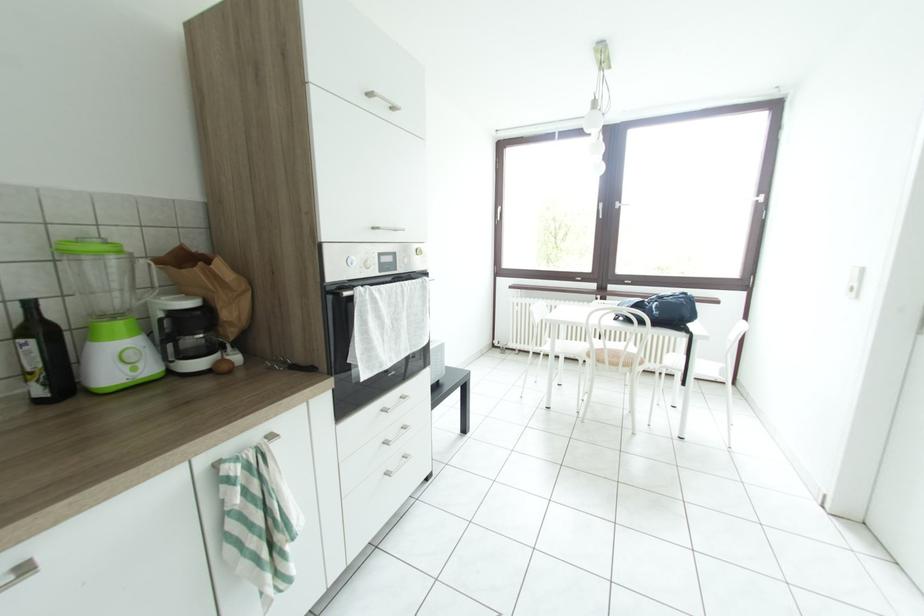
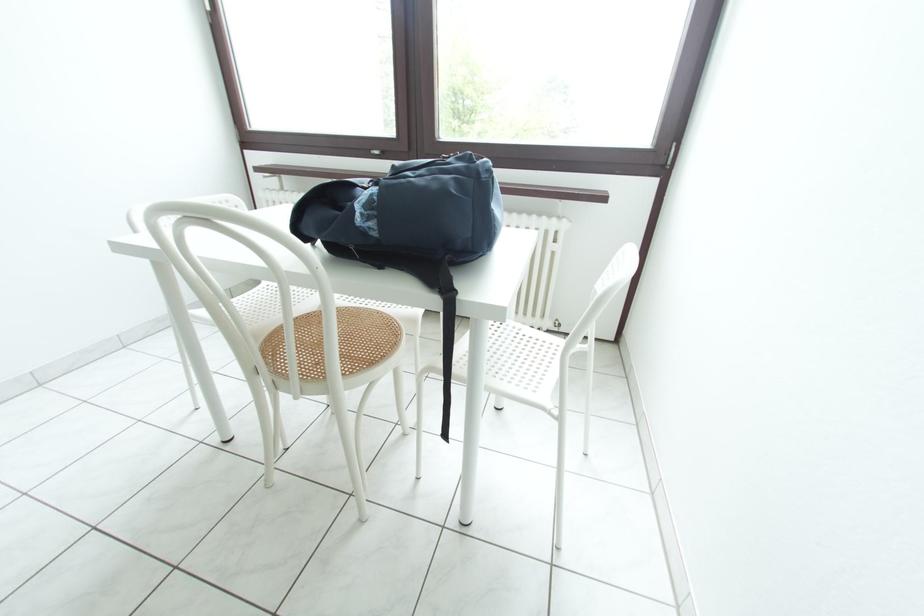
In a continuous first-person perspective shot, in which direction is the camera moving?

The movement direction of the cameraman is right, forward.